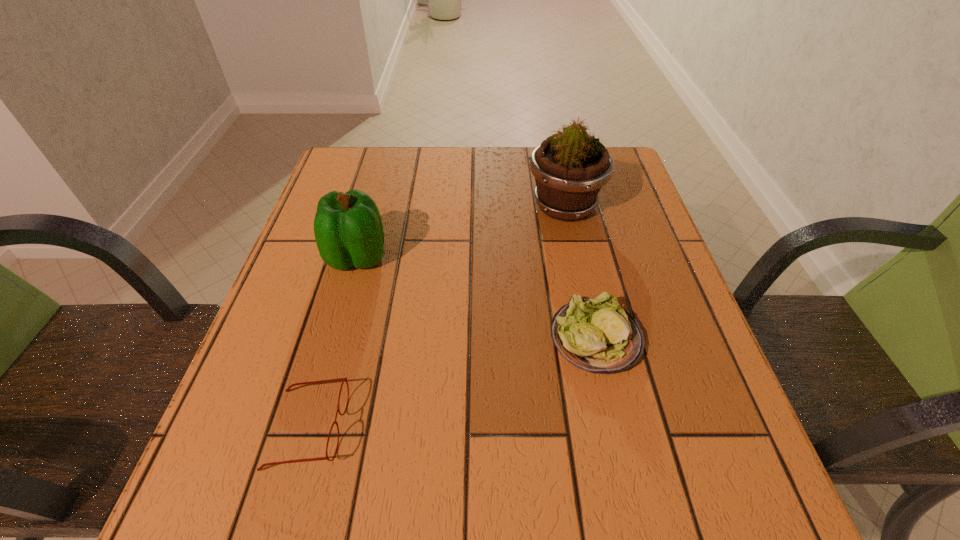
Image resolution: width=960 pixels, height=540 pixels. In order to click on free space at the far edge of the desktop in this screenshot , I will do `click(468, 184)`.

In the image, there is a desktop. At what (x,y) coordinates should I click in order to perform the action: click on free region at the left edge. Please return your answer as a coordinate pair (x, y). The height and width of the screenshot is (540, 960). Looking at the image, I should click on (275, 315).

Image resolution: width=960 pixels, height=540 pixels. Identify the location of vacant space at the right edge. (705, 438).

In the image, there is a desktop. Where is `vacant space at the far left corner`? The width and height of the screenshot is (960, 540). vacant space at the far left corner is located at coordinates (370, 164).

Where is `free space at the near left corner of the desktop`? The image size is (960, 540). free space at the near left corner of the desktop is located at coordinates (245, 521).

You are a GUI agent. You are given a task and a screenshot of the screen. Output one action in this format:
    pyautogui.click(x=<x>, y=<y>)
    Task: Click on the unoccupied position between the second shortest object and the nearest object
    
    Given the screenshot: What is the action you would take?
    pyautogui.click(x=451, y=383)

Identify the location of vacant space that is in between the bell pepper and the third farthest object. The width and height of the screenshot is (960, 540). (476, 298).

At what (x,y) coordinates should I click in order to perform the action: click on free point between the tallest object and the second farthest object. Please return your answer as a coordinate pair (x, y). Image resolution: width=960 pixels, height=540 pixels. Looking at the image, I should click on pos(461,232).

Image resolution: width=960 pixels, height=540 pixels. I want to click on vacant space that's between the shortest object and the third shortest object, so click(332, 343).

Where is `vacant area that lies between the third tallest object and the nearest object`? This screenshot has width=960, height=540. vacant area that lies between the third tallest object and the nearest object is located at coordinates (451, 383).